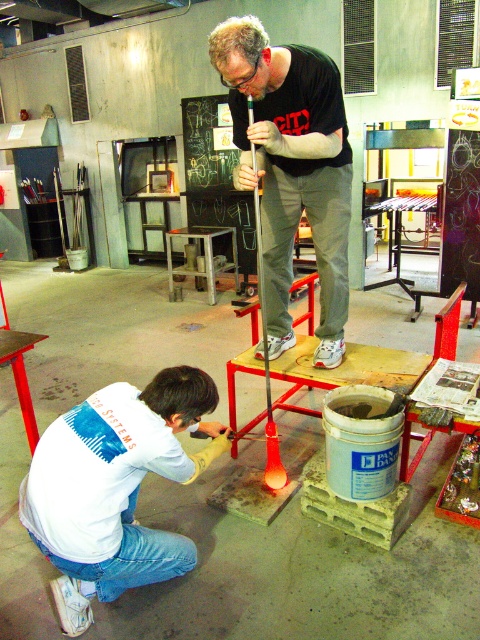
Between matte black shirt at center and metallic stool at center, which one has more height?

matte black shirt at center is taller.

Measure the distance between point [268,275] and camera.

They are 2.97 meters apart.

Identify the location of matte black shirt at center. (291, 168).

What do you see at coordinates (115, 486) in the screenshot? I see `white matte shirt at lower left` at bounding box center [115, 486].

Is point (181, 573) positioned behind point (312, 188)?

No, (181, 573) is closer to viewer.

Find the location of a particular element. white matte shirt at lower left is located at coordinates [115, 486].

Is white matte shirt at lower left above metallic stool at center?

Incorrect, white matte shirt at lower left is not positioned above metallic stool at center.

Is point (58, 472) more distant than point (170, 266)?

No, (58, 472) is in front of (170, 266).

Where is `white matte shirt at lower left`? This screenshot has width=480, height=640. white matte shirt at lower left is located at coordinates (115, 486).